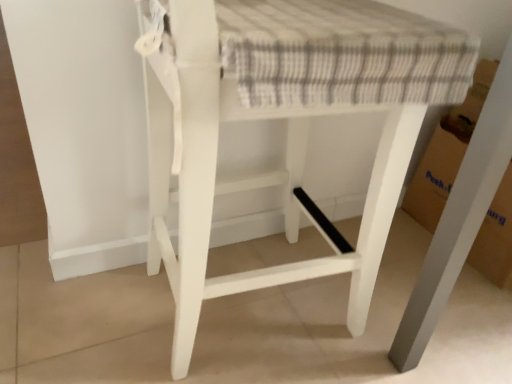
Question: Choose the correct answer: Is white painted wood stool at center inside cardboard at lower right or outside it?

Choices:
 (A) inside
 (B) outside

Answer: (B)

Question: From a real-world perspective, is white painted wood stool at center above or below cardboard at lower right?

Choices:
 (A) above
 (B) below

Answer: (A)

Question: Does point (303, 135) appear closer or farther from the camera than point (457, 150)?

Choices:
 (A) closer
 (B) farther

Answer: (A)

Question: Is cardboard at lower right taller or shorter than white painted wood stool at center?

Choices:
 (A) tall
 (B) short

Answer: (B)

Question: Is cardboard at lower right to the left or to the right of white painted wood stool at center in the image?

Choices:
 (A) right
 (B) left

Answer: (A)

Question: Is cardboard at lower right inside or outside of white painted wood stool at center?

Choices:
 (A) inside
 (B) outside

Answer: (B)

Question: From the image's perspective, is cardboard at lower right above or below white painted wood stool at center?

Choices:
 (A) below
 (B) above

Answer: (B)